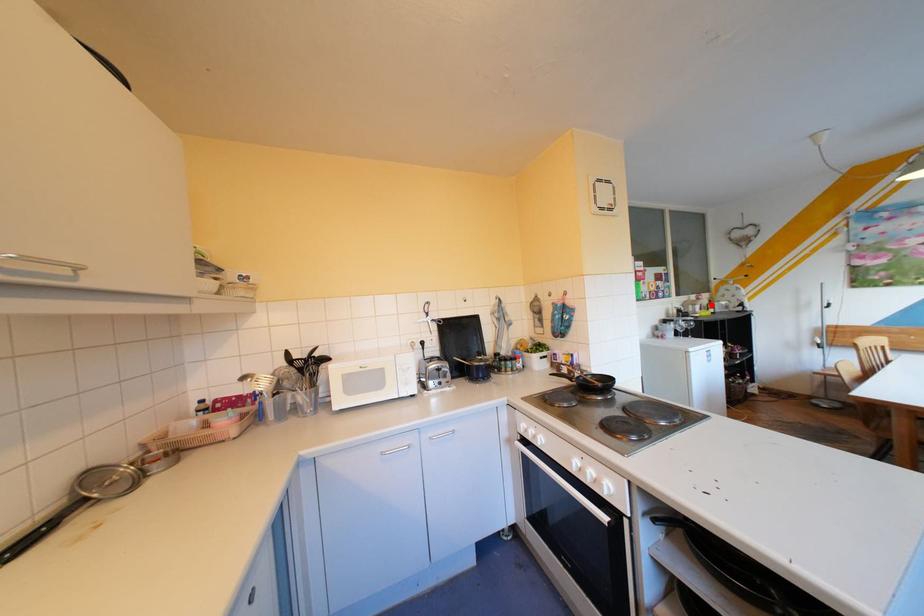
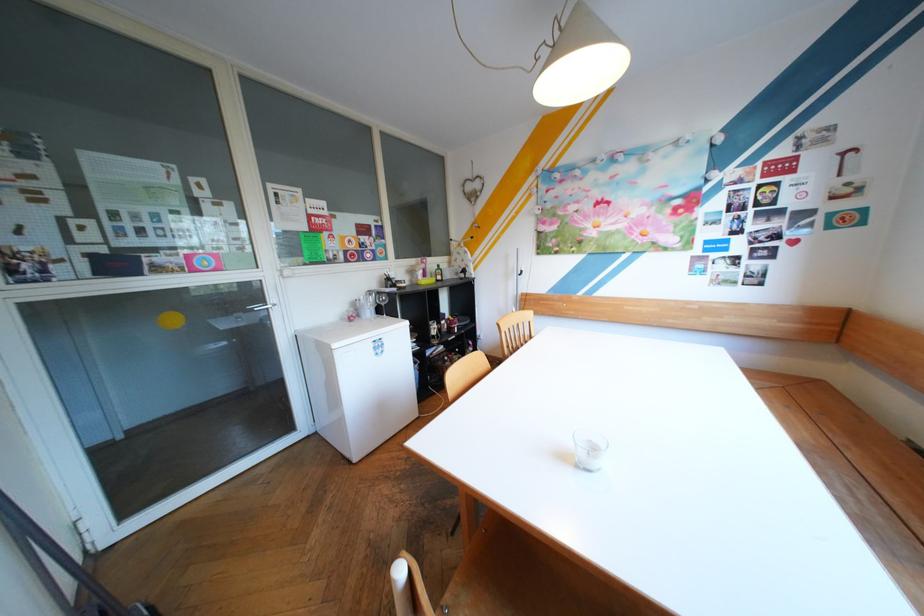
Question: A red point is marked in image1. In image2, is the corresponding 3D point closer to the camera or farther? Reply with the corresponding letter.

Choices:
 (A) The corresponding 3D point is closer.
 (B) The corresponding 3D point is farther.

Answer: (A)